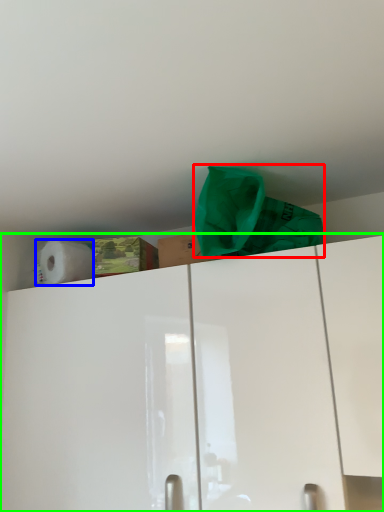
Question: Estimate the real-world distances between objects in this image. Which object is closer to material (highlighted by a red box), paper towel (highlighted by a blue box) or cabinetry (highlighted by a green box)?

Choices:
 (A) paper towel
 (B) cabinetry

Answer: (B)